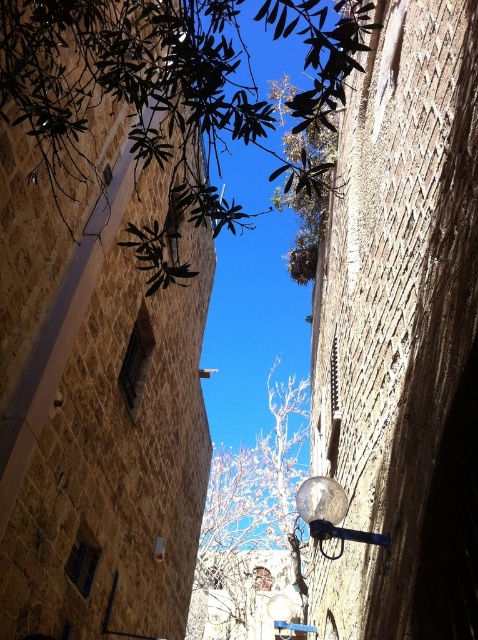
Can you confirm if green leafy tree at upper center is positioned to the right of satin silver globe at center?

Incorrect, green leafy tree at upper center is not on the right side of satin silver globe at center.

Find the location of a particular element. The width and height of the screenshot is (478, 640). green leafy tree at upper center is located at coordinates (141, 104).

Is point (236, 112) behind point (246, 470)?

No.

Between point (80, 109) and point (293, 531), which one is positioned behind?

Positioned behind is point (293, 531).

This screenshot has height=640, width=478. Describe the element at coordinates (141, 104) in the screenshot. I see `green leafy tree at upper center` at that location.

Find the location of `green leafy tree at upper center`. green leafy tree at upper center is located at coordinates (141, 104).

Between bare branches at center and satin silver globe at center, which one appears on the left side from the viewer's perspective?

bare branches at center

Is bare branches at center shorter than satin silver globe at center?

No, bare branches at center is not shorter than satin silver globe at center.

Find the location of a particular element. bare branches at center is located at coordinates (250, 525).